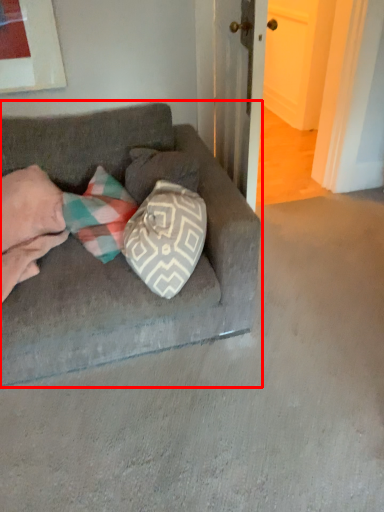
Question: From the image, what is the correct spatial relationship of studio couch (annotated by the red box) in relation to couple?

Choices:
 (A) right
 (B) left

Answer: (A)